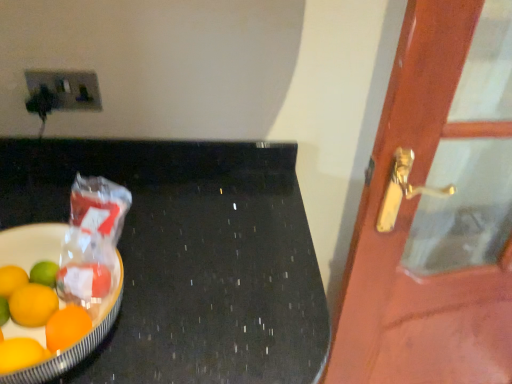
Describe the element at coordinates (436, 209) in the screenshot. The height and width of the screenshot is (384, 512). I see `wooden door at right` at that location.

Describe the element at coordinates (190, 257) in the screenshot. I see `black polished table at left` at that location.

Find the location of `black polished table at left`. black polished table at left is located at coordinates (190, 257).

Describe the element at coordinates (64, 90) in the screenshot. The image size is (512, 384). I see `matte plastic socket at upper left` at that location.

Image resolution: width=512 pixels, height=384 pixels. Identify the location of shiny plastic bowl at left. (78, 341).

Is shiny plastic bowl at left to the left of wooden door at right from the viewer's perspective?

Yes.

Can we say shiny plastic bowl at left lies outside wooden door at right?

Yes, shiny plastic bowl at left is located beyond the bounds of wooden door at right.

Considering the sizes of shiny plastic bowl at left and wooden door at right in the image, is shiny plastic bowl at left taller or shorter than wooden door at right?

In the image, shiny plastic bowl at left appears to be shorter than wooden door at right.

Considering the relative positions of shiny plastic bowl at left and matte plastic socket at upper left in the image provided, is shiny plastic bowl at left to the right of matte plastic socket at upper left from the viewer's perspective?

Yes, shiny plastic bowl at left is to the right of matte plastic socket at upper left.

Measure the distance between shiny plastic bowl at left and matte plastic socket at upper left.

16.58 inches.

Consider the image. How different are the orientations of shiny plastic bowl at left and matte plastic socket at upper left in degrees?

0.662 degrees.

Considering the sizes of shiny plastic bowl at left and matte plastic socket at upper left in the image, is shiny plastic bowl at left wider or thinner than matte plastic socket at upper left?

shiny plastic bowl at left is wider than matte plastic socket at upper left.

I want to click on table that is under the wooden door at right (from a real-world perspective), so click(190, 257).

From a real-world perspective, is wooden door at right above or below black polished table at left?

In terms of real-world spatial position, wooden door at right is above black polished table at left.

Visually, is wooden door at right positioned to the left or to the right of black polished table at left?

wooden door at right is to the right of black polished table at left.

Is black polished table at left a part of matte plastic socket at upper left?

No, matte plastic socket at upper left does not contain black polished table at left.

Is matte plastic socket at upper left further to the viewer compared to black polished table at left?

Yes, matte plastic socket at upper left is behind black polished table at left.

Are matte plastic socket at upper left and black polished table at left far apart?

That's not correct — matte plastic socket at upper left is a little close to black polished table at left.

Identify the location of door below the shiny plastic bowl at left (from the image's perspective). Image resolution: width=512 pixels, height=384 pixels. (436, 209).

Measure the distance between wooden door at right and shiny plastic bowl at left.

They are 29.86 inches apart.

Considering the relative sizes of wooden door at right and shiny plastic bowl at left in the image provided, is wooden door at right shorter than shiny plastic bowl at left?

Incorrect, the height of wooden door at right does not fall short of that of shiny plastic bowl at left.

Does black polished table at left have a greater height compared to wooden door at right?

No, black polished table at left is not taller than wooden door at right.

From the image's perspective, which is below, black polished table at left or wooden door at right?

black polished table at left appears lower in the image.

Considering the relative sizes of black polished table at left and wooden door at right in the image provided, is black polished table at left bigger than wooden door at right?

Yes, black polished table at left is bigger than wooden door at right.

Is black polished table at left oriented towards wooden door at right?

No, black polished table at left does not turn towards wooden door at right.

Considering the relative sizes of black polished table at left and shiny plastic bowl at left in the image provided, is black polished table at left thinner than shiny plastic bowl at left?

Incorrect, the width of black polished table at left is not less than that of shiny plastic bowl at left.

From the image's perspective, which is above, black polished table at left or shiny plastic bowl at left?

shiny plastic bowl at left, from the image's perspective.

Does black polished table at left have a smaller size compared to shiny plastic bowl at left?

No, black polished table at left is not smaller than shiny plastic bowl at left.

Is black polished table at left with shiny plastic bowl at left?

No, black polished table at left is not with shiny plastic bowl at left.

Locate an element on the screen. The width and height of the screenshot is (512, 384). door on the right of shiny plastic bowl at left is located at coordinates (436, 209).

Locate an element on the screen. The image size is (512, 384). fruit dish below the matte plastic socket at upper left (from the image's perspective) is located at coordinates (78, 341).

Considering their positions, is matte plastic socket at upper left positioned further to shiny plastic bowl at left than black polished table at left?

matte plastic socket at upper left.

When comparing their distances from black polished table at left, does matte plastic socket at upper left or shiny plastic bowl at left seem further?

matte plastic socket at upper left.

Estimate the real-world distances between objects in this image. Which object is closer to shiny plastic bowl at left, black polished table at left or wooden door at right?

Based on the image, black polished table at left appears to be nearer to shiny plastic bowl at left.

From the image, which object appears to be farther from matte plastic socket at upper left, wooden door at right or black polished table at left?

Among the two, wooden door at right is located further to matte plastic socket at upper left.

Considering their positions, is wooden door at right positioned further to black polished table at left than shiny plastic bowl at left?

The object further to black polished table at left is wooden door at right.

Based on their spatial positions, is matte plastic socket at upper left or black polished table at left further from wooden door at right?

The object further to wooden door at right is matte plastic socket at upper left.

Consider the image. Looking at the image, which one is located closer to black polished table at left, wooden door at right or matte plastic socket at upper left?

The object closer to black polished table at left is matte plastic socket at upper left.

Considering their positions, is wooden door at right positioned closer to shiny plastic bowl at left than matte plastic socket at upper left?

matte plastic socket at upper left is closer to shiny plastic bowl at left.

At what (x,y) coordinates should I click in order to perform the action: click on table between matte plastic socket at upper left and wooden door at right from left to right. Please return your answer as a coordinate pair (x, y). The image size is (512, 384). Looking at the image, I should click on (190, 257).

Where is `fruit dish situated between matte plastic socket at upper left and wooden door at right from left to right`? The height and width of the screenshot is (384, 512). fruit dish situated between matte plastic socket at upper left and wooden door at right from left to right is located at coordinates (78, 341).

Identify the location of fruit dish between matte plastic socket at upper left and black polished table at left from top to bottom. The image size is (512, 384). (78, 341).

This screenshot has height=384, width=512. I want to click on table between shiny plastic bowl at left and wooden door at right from left to right, so click(x=190, y=257).